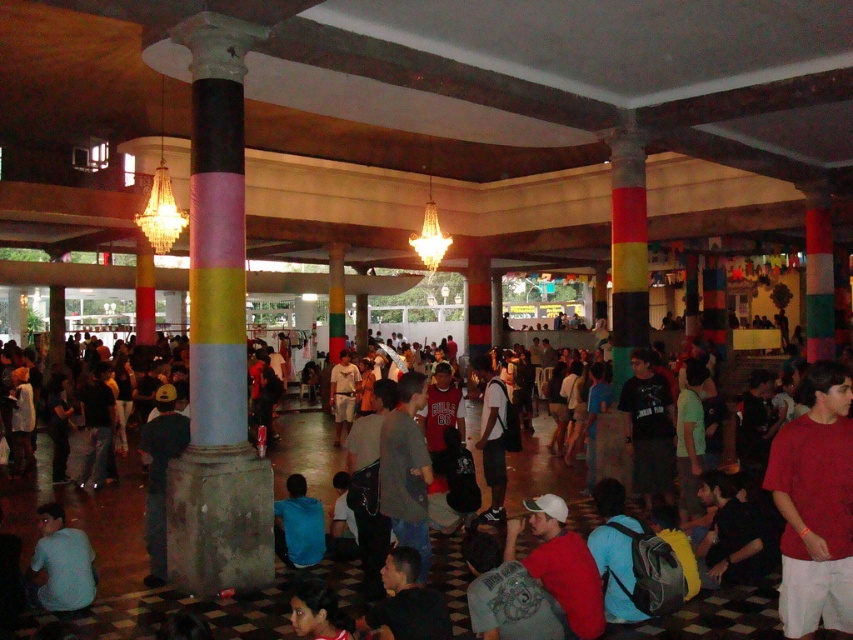
Does gray cotton shirt at center have a larger size compared to blue fabric shirt at lower center?

Correct, gray cotton shirt at center is larger in size than blue fabric shirt at lower center.

Which is in front, point (396, 442) or point (312, 515)?

Point (396, 442) is in front.

You are a GUI agent. You are given a task and a screenshot of the screen. Output one action in this format:
    pyautogui.click(x=<x>, y=<y>)
    Task: Click on the gray cotton shirt at center
    The image size is (853, 640).
    Given the screenshot: What is the action you would take?
    pyautogui.click(x=405, y=468)

Is light blue shirt at lower left taller than blue fabric shirt at lower center?

Correct, light blue shirt at lower left is much taller as blue fabric shirt at lower center.

Can you confirm if light blue shirt at lower left is shorter than blue fabric shirt at lower center?

No, light blue shirt at lower left is not shorter than blue fabric shirt at lower center.

Is point (90, 561) farther from viewer compared to point (281, 557)?

No, it is not.

Find the location of a particular element. The height and width of the screenshot is (640, 853). light blue shirt at lower left is located at coordinates (62, 563).

Is gray cotton shirt at center thinner than light blue shirt at lower left?

Yes, gray cotton shirt at center is thinner than light blue shirt at lower left.

Between gray cotton shirt at center and light blue shirt at lower left, which one appears on the right side from the viewer's perspective?

Positioned to the right is gray cotton shirt at center.

Who is more distant from viewer, (x=416, y=529) or (x=70, y=596)?

The point (x=70, y=596) is behind.

You are a GUI agent. You are given a task and a screenshot of the screen. Output one action in this format:
    pyautogui.click(x=<x>, y=<y>)
    Task: Click on the gray cotton shirt at center
    
    Given the screenshot: What is the action you would take?
    pyautogui.click(x=405, y=468)